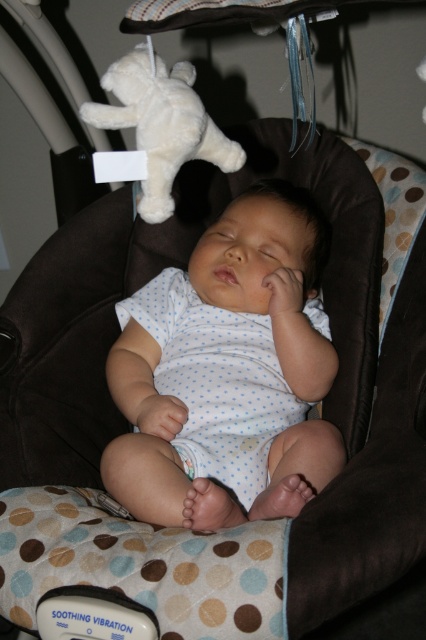
Question: Which point appears farthest from the camera in this image?

Choices:
 (A) (164, 220)
 (B) (167, 452)

Answer: (A)

Question: Can you confirm if white dotted onesie at center is positioned to the right of white plush bear at upper left?

Choices:
 (A) yes
 (B) no

Answer: (A)

Question: Which point appears closest to the camera in this image?

Choices:
 (A) (201, 116)
 (B) (115, 365)

Answer: (A)

Question: Is white dotted onesie at center above white plush bear at upper left?

Choices:
 (A) no
 (B) yes

Answer: (A)

Question: Can you confirm if white dotted onesie at center is positioned to the left of white plush bear at upper left?

Choices:
 (A) no
 (B) yes

Answer: (A)